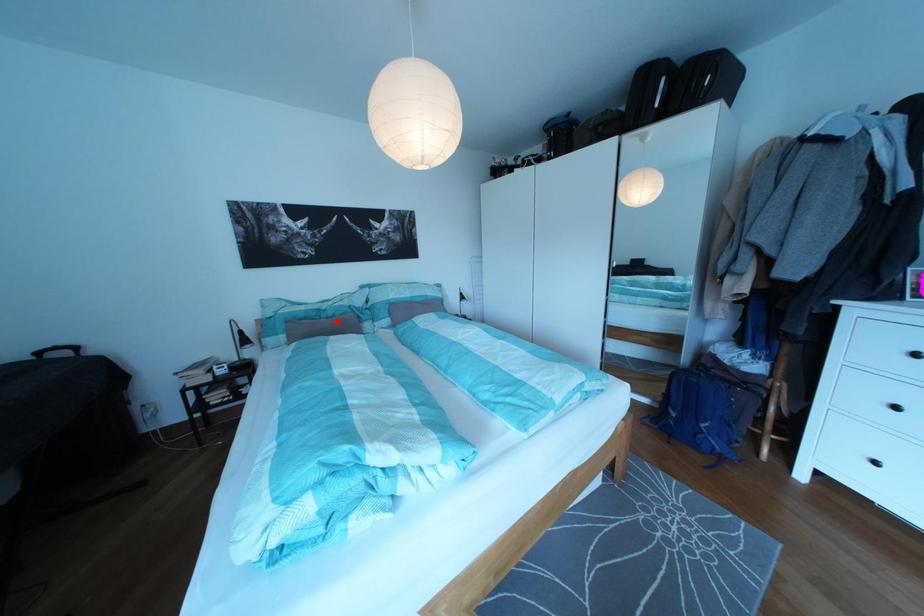
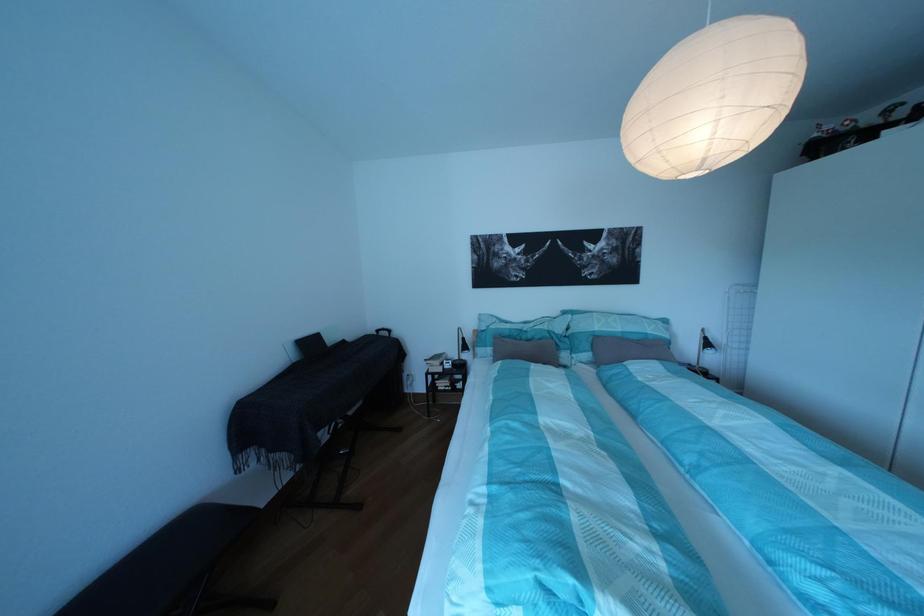
Find the pixel in the second image that matches the highlighted location in the first image.

(538, 342)